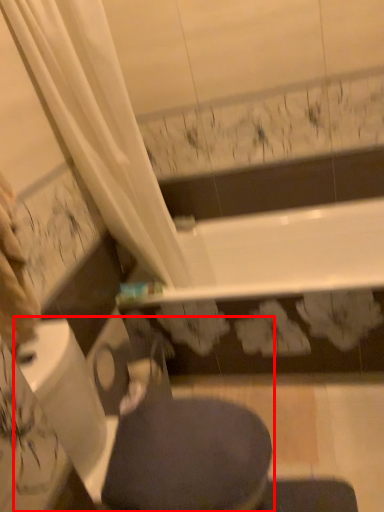
Question: In this image, where is swivel chair (annotated by the red box) located relative to bidet?

Choices:
 (A) left
 (B) right

Answer: (A)